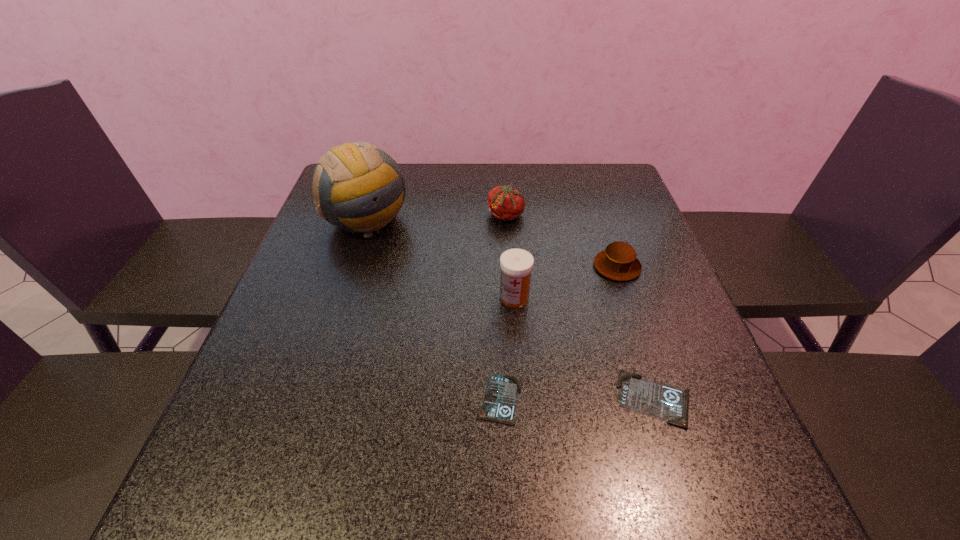
Observe the arrangement of all identity cards in the image. To keep them evenly spaced, where would you place another identity card on the left? Please locate a free space. Please provide its 2D coordinates. Your answer should be formatted as a tuple, i.e. [(x, y)], where the tuple contains the x and y coordinates of a point satisfying the conditions above.

[(348, 399)]